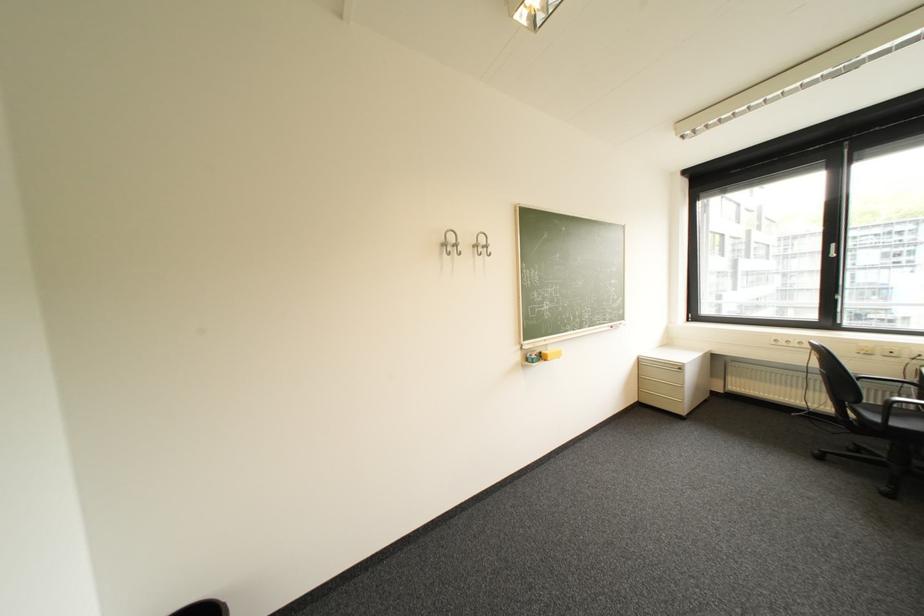
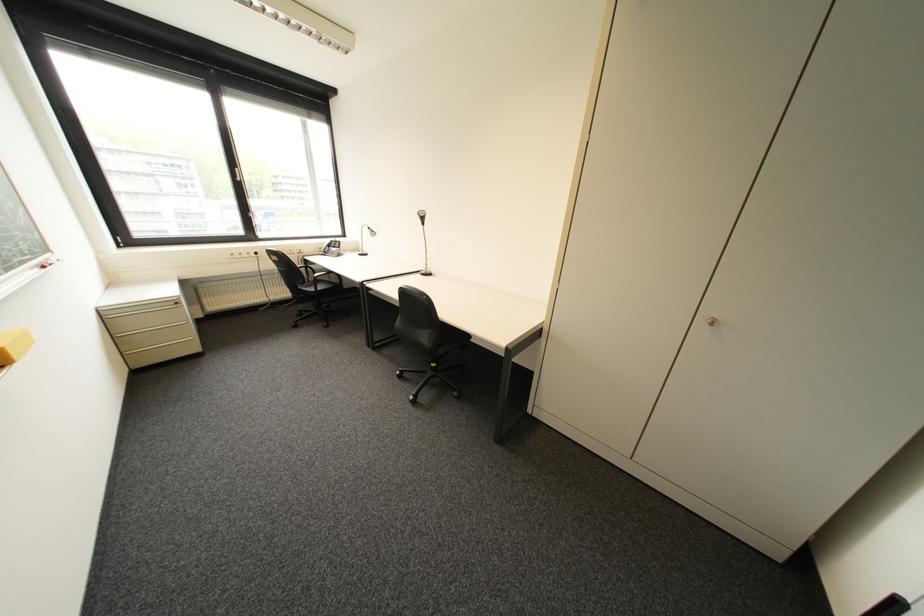
Locate, in the second image, the point that corresponds to point (844, 256) in the first image.

(249, 180)